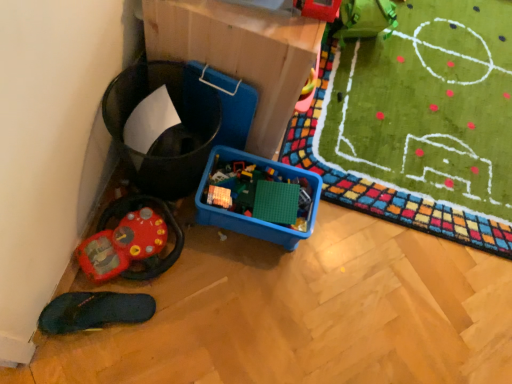
Question: Is cardboard at upper center bigger than rubberized red steering wheel at lower left, which is the 1th toy from bottom to top?

Choices:
 (A) yes
 (B) no

Answer: (A)

Question: From a real-world perspective, does cardboard at upper center sit lower than rubberized red steering wheel at lower left, which is the 1th toy from bottom to top?

Choices:
 (A) no
 (B) yes

Answer: (A)

Question: Is cardboard at upper center with rubberized red steering wheel at lower left, which appears as the first toy when viewed from the back?

Choices:
 (A) yes
 (B) no

Answer: (B)

Question: From the image's perspective, does cardboard at upper center appear lower than rubberized red steering wheel at lower left, acting as the 2th toy starting from the front?

Choices:
 (A) yes
 (B) no

Answer: (B)

Question: Can we say cardboard at upper center lies outside rubberized red steering wheel at lower left, acting as the 2th toy starting from the front?

Choices:
 (A) yes
 (B) no

Answer: (A)

Question: From the image's perspective, relative to rubberized plastic toy at upper right, marked as the 1th toy in a top-to-bottom arrangement, is rubberized red steering wheel at lower left, which appears as the second toy when viewed from the right, above or below?

Choices:
 (A) below
 (B) above

Answer: (A)

Question: In terms of width, does rubberized red steering wheel at lower left, which appears as the first toy when viewed from the back, look wider or thinner when compared to rubberized plastic toy at upper right, which is the 1th toy in right-to-left order?

Choices:
 (A) thin
 (B) wide

Answer: (B)

Question: From their relative heights in the image, would you say rubberized red steering wheel at lower left, the 1th toy viewed from the left, is taller or shorter than rubberized plastic toy at upper right, which is the 1th toy in right-to-left order?

Choices:
 (A) tall
 (B) short

Answer: (B)

Question: Relative to rubberized plastic toy at upper right, acting as the 2th toy starting from the back, is rubberized red steering wheel at lower left, which appears as the second toy when viewed from the top, in front or behind?

Choices:
 (A) behind
 (B) front

Answer: (A)

Question: From their relative heights in the image, would you say black rubber slipper at lower left is taller or shorter than rubberized red steering wheel at lower left, which appears as the second toy when viewed from the right?

Choices:
 (A) short
 (B) tall

Answer: (A)

Question: Considering their positions, is black rubber slipper at lower left located in front of or behind rubberized red steering wheel at lower left, which appears as the second toy when viewed from the right?

Choices:
 (A) front
 (B) behind

Answer: (A)

Question: Is black rubber slipper at lower left to the left or to the right of rubberized red steering wheel at lower left, which appears as the first toy when viewed from the back, in the image?

Choices:
 (A) left
 (B) right

Answer: (A)

Question: Is black rubber slipper at lower left wider or thinner than rubberized red steering wheel at lower left, which is the 1th toy from bottom to top?

Choices:
 (A) thin
 (B) wide

Answer: (B)

Question: Is rubberized red steering wheel at lower left, acting as the 2th toy starting from the front, in front of or behind black rubber slipper at lower left in the image?

Choices:
 (A) front
 (B) behind

Answer: (B)

Question: In terms of height, does rubberized red steering wheel at lower left, acting as the 2th toy starting from the front, look taller or shorter compared to black rubber slipper at lower left?

Choices:
 (A) short
 (B) tall

Answer: (B)